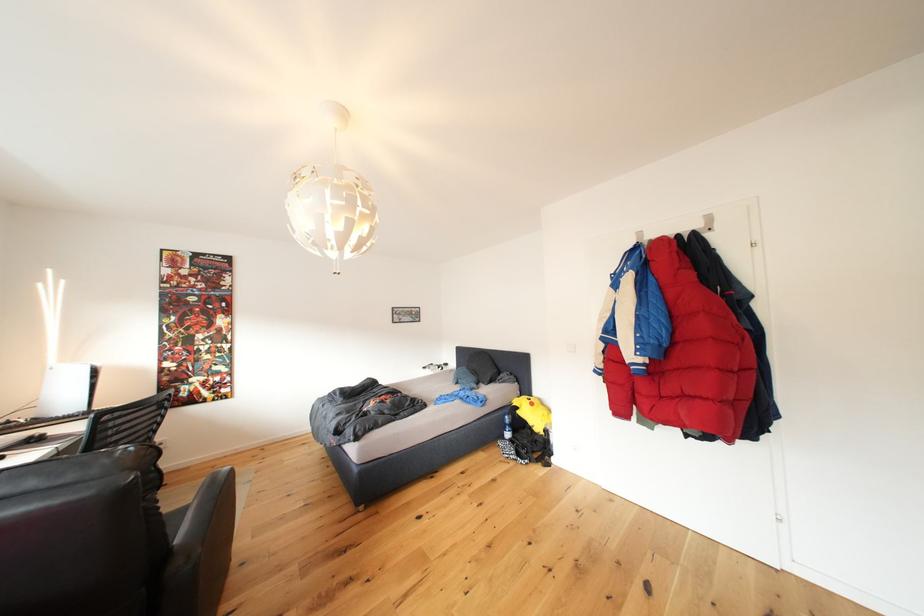
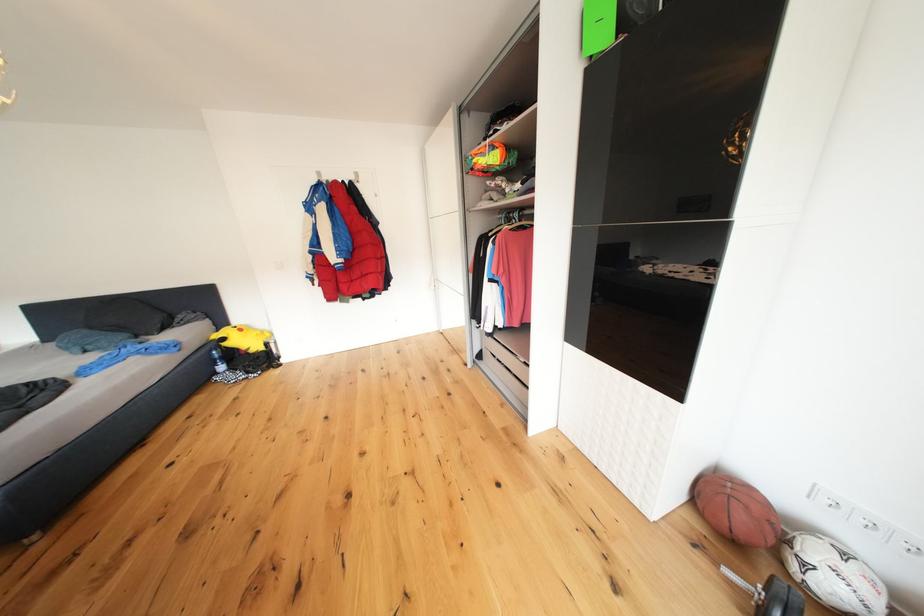
The images are taken continuously from a first-person perspective. In which direction is your viewpoint rotating?

The rotation direction of the camera is right-down.